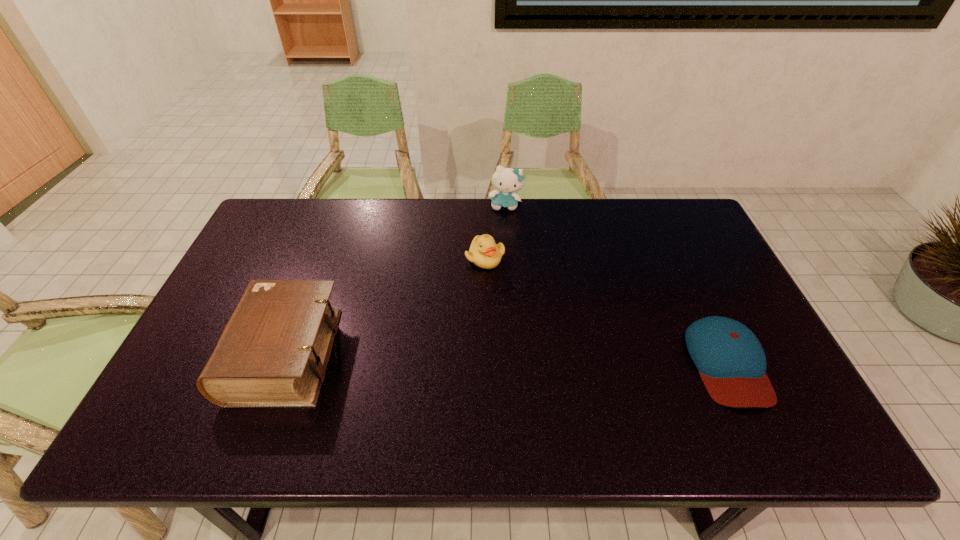
Locate an element on the screen. This screenshot has width=960, height=540. object that is at the left edge is located at coordinates (273, 352).

Identify the location of object that is at the right edge. The width and height of the screenshot is (960, 540). click(x=731, y=362).

The height and width of the screenshot is (540, 960). Identify the location of object at the near left corner. (273, 352).

Image resolution: width=960 pixels, height=540 pixels. I want to click on object that is at the near right corner, so click(731, 362).

In the image, there is a desktop. Where is `vacant space at the far edge`? vacant space at the far edge is located at coordinates (420, 222).

At what (x,y) coordinates should I click in order to perform the action: click on free space at the near edge of the desktop. Please return your answer as a coordinate pair (x, y). The width and height of the screenshot is (960, 540). Looking at the image, I should click on (556, 398).

The height and width of the screenshot is (540, 960). Find the location of `vacant space at the right edge`. vacant space at the right edge is located at coordinates (695, 245).

Locate an element on the screen. Image resolution: width=960 pixels, height=540 pixels. vacant space at the far left corner is located at coordinates (316, 202).

The image size is (960, 540). I want to click on free spot between the shortest object and the Bible, so click(506, 359).

The image size is (960, 540). I want to click on empty space that is in between the shortest object and the duckling, so click(x=606, y=310).